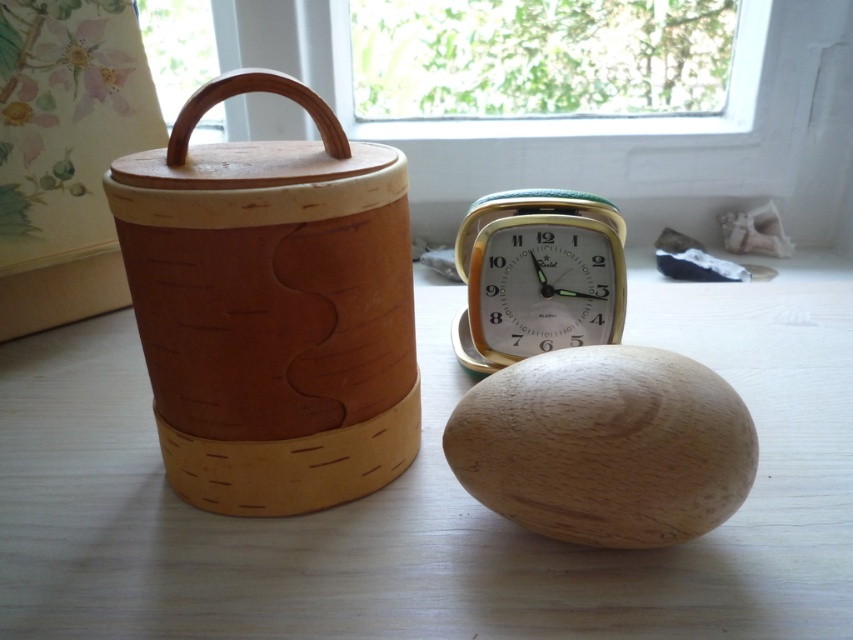
You are setting up a small desk organizer and need to place both the natural wood table at center and the metallic gold alarm clock at center on the same shelf. The shelf has a height limit of 10 cm. Which item might not fit due to its height?

The natural wood table at center is taller than the metallic gold alarm clock at center, so the natural wood table at center might not fit on the shelf due to its height exceeding the 10 cm limit.

You are organizing items on a desk and want to place the metallic gold alarm clock at center on top of the natural wood table at center. Is this possible?

The natural wood table at center is positioned under the metallic gold alarm clock at center, so yes, you can place the metallic gold alarm clock at center on top of the natural wood table at center since it is already positioned underneath.

You are organizing items on a natural wood table at center and need to place a metallic gold alarm clock at center. Considering their sizes, which item has a larger width?

The natural wood table at center has a larger width than the metallic gold alarm clock at center.